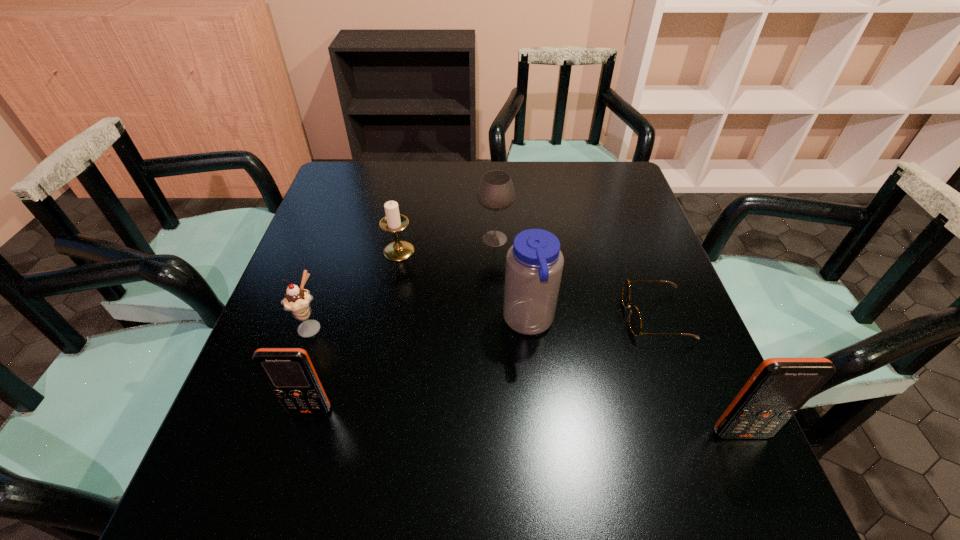
Identify which object is the fifth closest to the icecream. Please provide its 2D coordinates. Your answer should be formatted as a tuple, i.e. [(x, y)], where the tuple contains the x and y coordinates of a point satisfying the conditions above.

[(635, 322)]